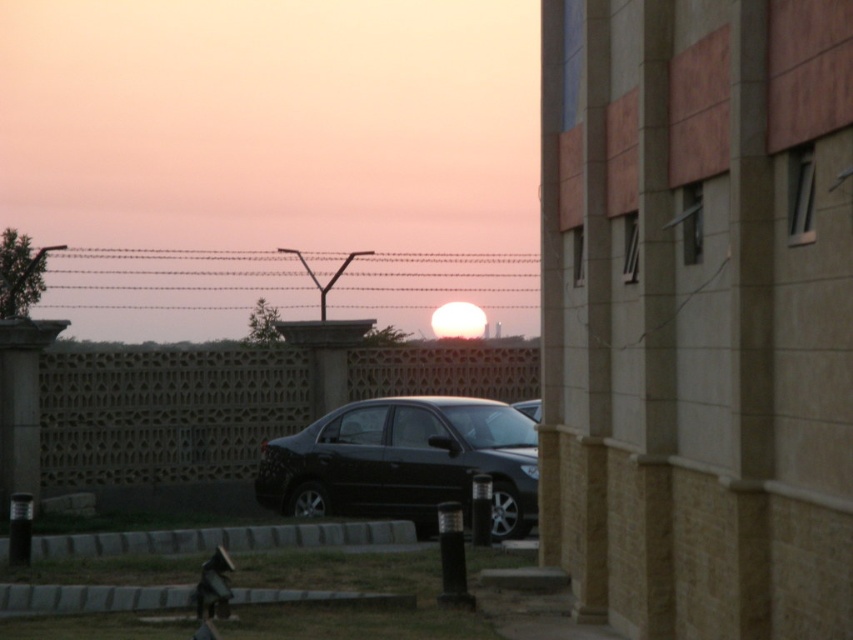
Question: Can you confirm if light brown textured wall at center is positioned to the right of glossy black car at center?

Choices:
 (A) yes
 (B) no

Answer: (B)

Question: Is light brown textured wall at center wider than glossy black car at center?

Choices:
 (A) no
 (B) yes

Answer: (A)

Question: Which of the following is the farthest from the observer?

Choices:
 (A) light brown textured wall at center
 (B) glossy black car at center

Answer: (A)

Question: Among these points, which one is farthest from the camera?

Choices:
 (A) (521, 397)
 (B) (509, 456)

Answer: (A)

Question: Among these points, which one is farthest from the camera?

Choices:
 (A) (47, 387)
 (B) (393, 499)

Answer: (A)

Question: Is light brown textured wall at center to the left of glossy black car at center from the viewer's perspective?

Choices:
 (A) yes
 (B) no

Answer: (A)